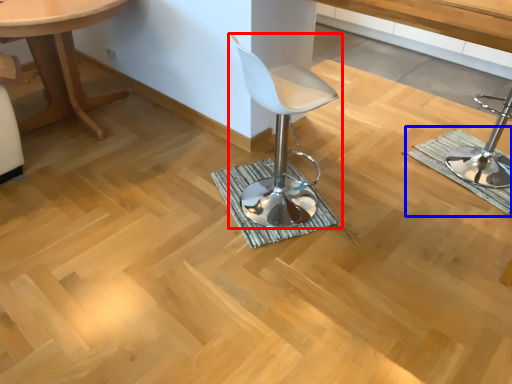
Question: Which object appears closest to the camera in this image, chair (highlighted by a red box) or bath mat (highlighted by a blue box)?

Choices:
 (A) chair
 (B) bath mat

Answer: (A)